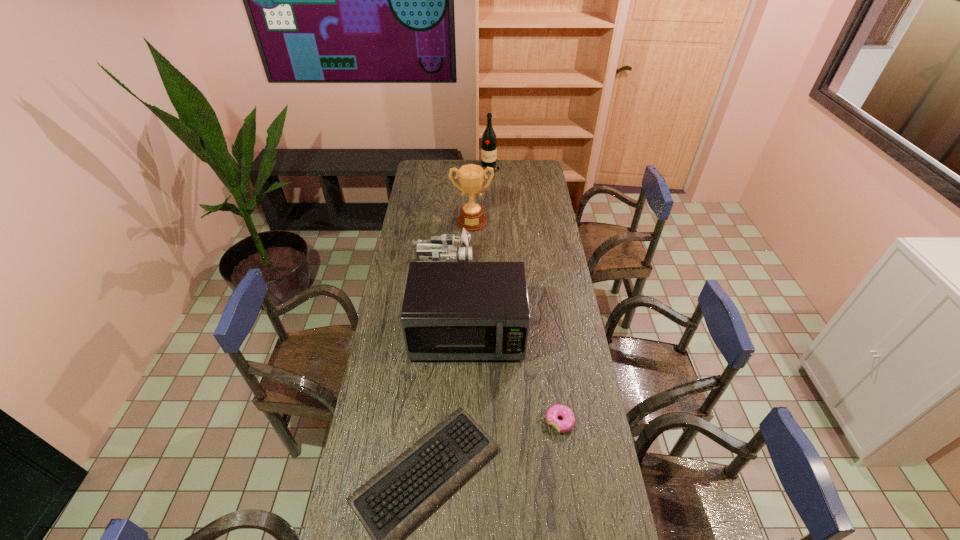
Where is `vacant region located 0.230m on the front-facing side of the fourth tallest object`? This screenshot has width=960, height=540. vacant region located 0.230m on the front-facing side of the fourth tallest object is located at coordinates (521, 261).

Identify the location of vacant space located on the back of the rightmost object. This screenshot has height=540, width=960. (554, 383).

Image resolution: width=960 pixels, height=540 pixels. Find the location of `object located in the far edge section of the desktop`. object located in the far edge section of the desktop is located at coordinates (489, 141).

The width and height of the screenshot is (960, 540). Find the location of `microwave oven at the left edge`. microwave oven at the left edge is located at coordinates (451, 310).

Locate an element on the screen. This screenshot has width=960, height=540. camcorder at the left edge is located at coordinates (442, 248).

The image size is (960, 540). What are the coordinates of `object located in the right edge section of the desktop` in the screenshot? It's located at (562, 426).

This screenshot has height=540, width=960. Identify the location of vacant space at the far edge of the desktop. [517, 177].

The width and height of the screenshot is (960, 540). I want to click on vacant space at the left edge of the desktop, so click(377, 354).

This screenshot has height=540, width=960. In the image, there is a desktop. In order to click on vacant space at the right edge in this screenshot , I will do `click(608, 503)`.

Locate an element on the screen. This screenshot has width=960, height=540. vacant space at the far left corner of the desktop is located at coordinates (429, 162).